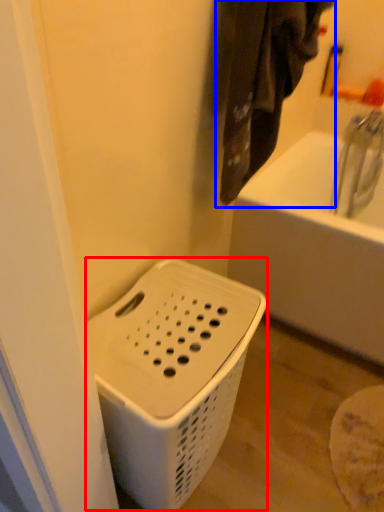
Question: Which object appears farthest to the camera in this image, basket container (highlighted by a red box) or laundry (highlighted by a blue box)?

Choices:
 (A) basket container
 (B) laundry

Answer: (B)